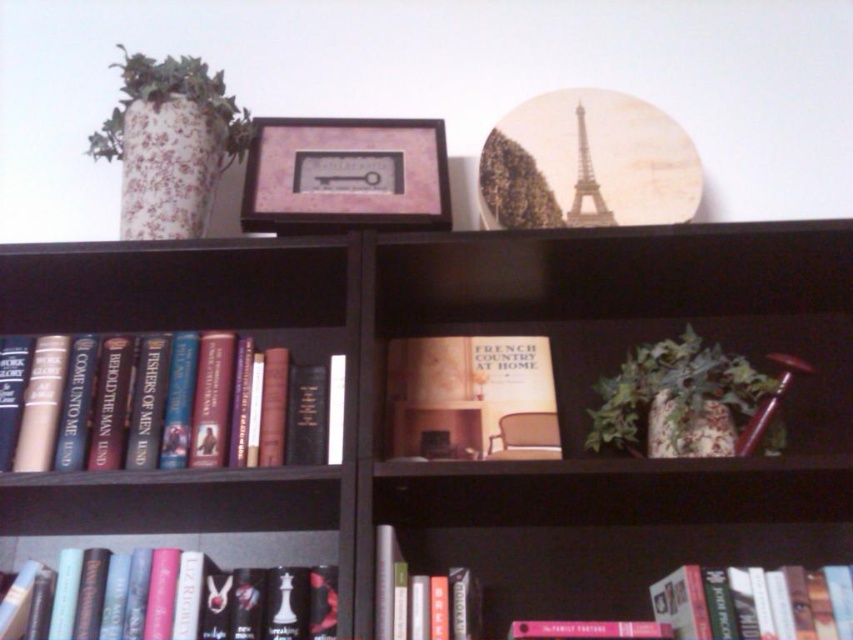
Does matte wooden picture frame at upper center have a smaller size compared to hardcover book at lower right?

Actually, matte wooden picture frame at upper center might be larger than hardcover book at lower right.

Identify the location of matte wooden picture frame at upper center. The image size is (853, 640). (345, 176).

Who is higher up, hardcover book at lower right or green leafy plant at upper center?

green leafy plant at upper center is higher up.

Is hardcover book at lower right behind green leafy plant at upper center?

No, it is in front of green leafy plant at upper center.

Is point (730, 598) positioned in front of point (496, 172)?

Yes, point (730, 598) is in front of point (496, 172).

Where is `hardcover book at lower right`? Image resolution: width=853 pixels, height=640 pixels. hardcover book at lower right is located at coordinates (753, 602).

Measure the distance from hardcover book at lower left to hardcover book at center.

They are 8.14 inches apart.

The width and height of the screenshot is (853, 640). What are the coordinates of `hardcover book at lower left` in the screenshot? It's located at (166, 598).

Based on the photo, who is more forward, [64,636] or [393,592]?

Positioned in front is point [64,636].

In order to click on hardcover book at lower left in this screenshot , I will do click(x=166, y=598).